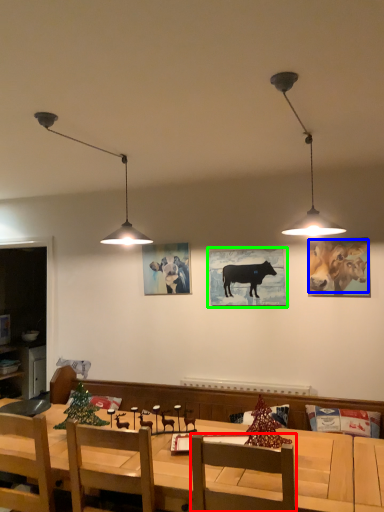
Question: Which object is the farthest from chair (highlighted by a red box)? Choose among these: cattle (highlighted by a blue box) or picture frame (highlighted by a green box).

Choices:
 (A) cattle
 (B) picture frame

Answer: (A)